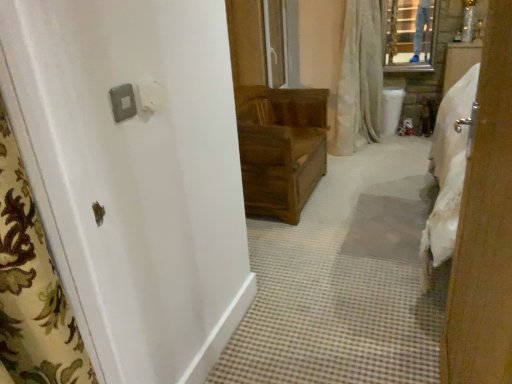
Question: Can you confirm if white plastic light switch at upper left, the first light switch viewed from the right, is positioned to the right of satin silver switch at upper left, acting as the 2th light switch starting from the right?

Choices:
 (A) no
 (B) yes

Answer: (B)

Question: Considering the relative sizes of white plastic light switch at upper left, which is counted as the second light switch, starting from the left, and satin silver switch at upper left, acting as the 2th light switch starting from the right, in the image provided, is white plastic light switch at upper left, which is counted as the second light switch, starting from the left, taller than satin silver switch at upper left, acting as the 2th light switch starting from the right,?

Choices:
 (A) no
 (B) yes

Answer: (B)

Question: Can you confirm if white plastic light switch at upper left, the first light switch viewed from the right, is positioned to the left of satin silver switch at upper left, acting as the 2th light switch starting from the right?

Choices:
 (A) yes
 (B) no

Answer: (B)

Question: Is the depth of white plastic light switch at upper left, which is counted as the second light switch, starting from the left, less than that of satin silver switch at upper left, which ranks as the first light switch in left-to-right order?

Choices:
 (A) no
 (B) yes

Answer: (A)

Question: Would you say white plastic light switch at upper left, which is counted as the second light switch, starting from the left, is a long distance from satin silver switch at upper left, which ranks as the first light switch in left-to-right order?

Choices:
 (A) no
 (B) yes

Answer: (A)

Question: Considering the positions of satin silver switch at upper left, which ranks as the first light switch in left-to-right order, and wooden door at center in the image, is satin silver switch at upper left, which ranks as the first light switch in left-to-right order, taller or shorter than wooden door at center?

Choices:
 (A) tall
 (B) short

Answer: (B)

Question: Considering the relative positions of satin silver switch at upper left, acting as the 2th light switch starting from the right, and wooden door at center in the image provided, is satin silver switch at upper left, acting as the 2th light switch starting from the right, to the left or to the right of wooden door at center?

Choices:
 (A) right
 (B) left

Answer: (B)

Question: From the image's perspective, relative to wooden door at center, is satin silver switch at upper left, acting as the 2th light switch starting from the right, above or below?

Choices:
 (A) below
 (B) above

Answer: (B)

Question: Is point (121, 117) closer or farther from the camera than point (179, 162)?

Choices:
 (A) farther
 (B) closer

Answer: (B)

Question: Considering the positions of white plastic light switch at upper left, the first light switch viewed from the right, and satin silver switch at upper left, acting as the 2th light switch starting from the right, in the image, is white plastic light switch at upper left, the first light switch viewed from the right, wider or thinner than satin silver switch at upper left, acting as the 2th light switch starting from the right,?

Choices:
 (A) thin
 (B) wide

Answer: (B)

Question: From the image's perspective, is white plastic light switch at upper left, which is counted as the second light switch, starting from the left, positioned above or below satin silver switch at upper left, which ranks as the first light switch in left-to-right order?

Choices:
 (A) below
 (B) above

Answer: (B)

Question: Is white plastic light switch at upper left, the first light switch viewed from the right, to the left or to the right of satin silver switch at upper left, acting as the 2th light switch starting from the right, in the image?

Choices:
 (A) left
 (B) right

Answer: (B)

Question: Considering the positions of point (147, 105) and point (114, 96), is point (147, 105) closer or farther from the camera than point (114, 96)?

Choices:
 (A) farther
 (B) closer

Answer: (A)

Question: Based on their positions, is wooden chest at center located to the left or right of satin silver switch at upper left, acting as the 2th light switch starting from the right?

Choices:
 (A) right
 (B) left

Answer: (A)

Question: Do you think wooden chest at center is within satin silver switch at upper left, which ranks as the first light switch in left-to-right order, or outside of it?

Choices:
 (A) inside
 (B) outside

Answer: (B)